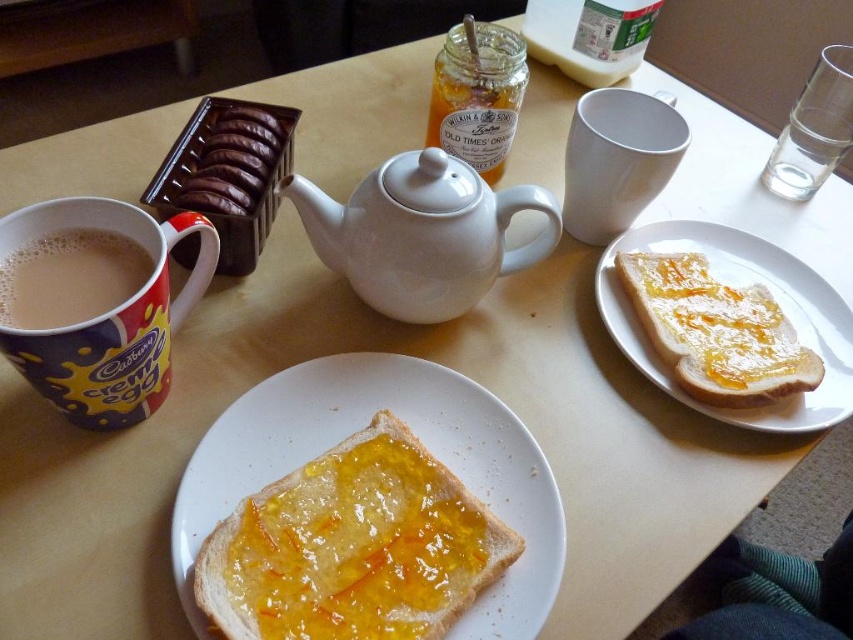
Based on the photo, you are setting up a breakfast table and want to place a saucer under the white glossy teapot at center. Is there enough vertical space between the teapot and the matte ceramic mug at left to fit the saucer?

The white glossy teapot at center is above the matte ceramic mug at left, so there is enough vertical space between them to place a saucer underneath the teapot without touching the mug.

Where is the white ceramic plate at upper right located in the image?

The white ceramic plate at upper right is located at point (741, 284) in the image.

You are setting up a tea service for two guests. You have a white glossy teapot at center and a matte ceramic mug at left. Which item should you use to pour hot tea into the cups to avoid splashing, and why?

You should use the white glossy teapot at center because its larger width compared to the matte ceramic mug at left provides better control when pouring, reducing the risk of splashing.